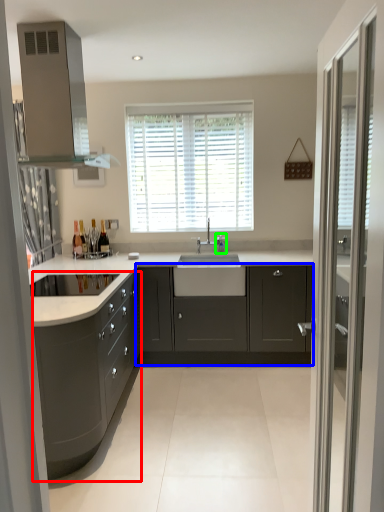
Question: Which object is the farthest from cabinetry (highlighted by a red box)? Choose among these: cabinetry (highlighted by a blue box) or faucet (highlighted by a green box).

Choices:
 (A) cabinetry
 (B) faucet

Answer: (B)